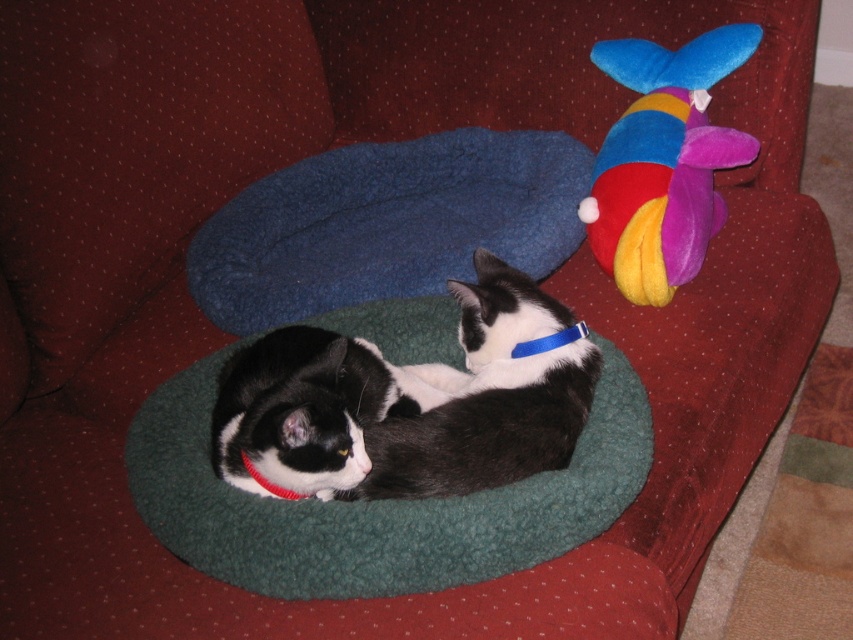
Question: From the image, what is the correct spatial relationship of blue fleece cat bed at center in relation to black soft fur cat at center?

Choices:
 (A) left
 (B) right

Answer: (B)

Question: Based on their relative distances, which object is farther from the black soft fur cat at center?

Choices:
 (A) black and white fur at center
 (B) red fabric neckband at lower left
 (C) green fleece cat bed at center
 (D) blue fleece cat bed at center

Answer: (D)

Question: Is black soft fur cat at center above red fabric neckband at lower left?

Choices:
 (A) no
 (B) yes

Answer: (B)

Question: Does velvet plush toy at upper right have a greater width compared to black soft fur cat at center?

Choices:
 (A) yes
 (B) no

Answer: (B)

Question: Which object is the closest to the black soft fur cat at center?

Choices:
 (A) blue fleece cat bed at center
 (B) blue fabric neckband at center
 (C) green fleece cat bed at center

Answer: (C)

Question: Based on their relative distances, which object is nearer to the blue fleece cat bed at center?

Choices:
 (A) red fabric neckband at lower left
 (B) green fleece cat bed at center

Answer: (B)